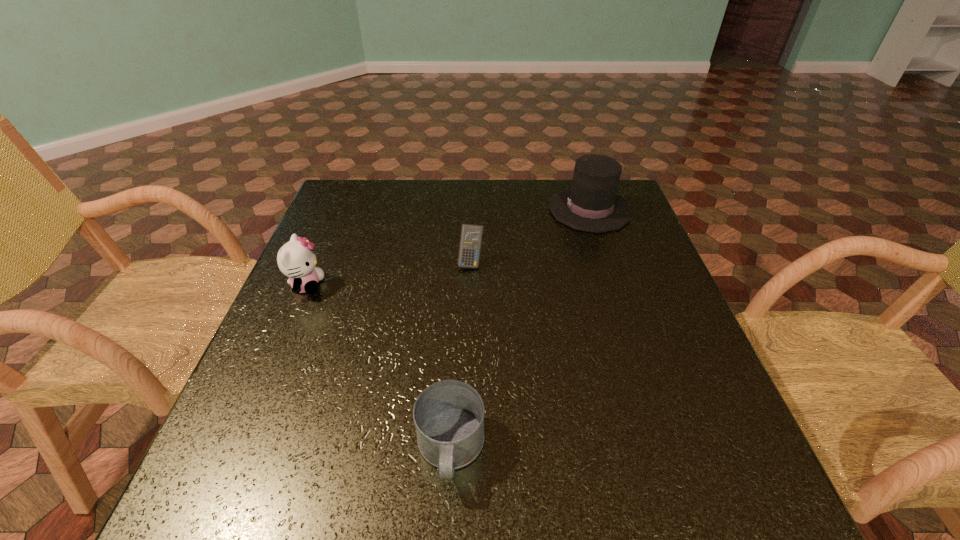
Find the location of `vacant space located 0.110m on the front-facing side of the third tallest object`. vacant space located 0.110m on the front-facing side of the third tallest object is located at coordinates pos(469,303).

At what (x,y) coordinates should I click in order to perform the action: click on object that is at the far edge. Please return your answer as a coordinate pair (x, y). Image resolution: width=960 pixels, height=540 pixels. Looking at the image, I should click on point(591,204).

Identify the location of object that is at the near edge. (448, 415).

Where is `object that is at the left edge`? The image size is (960, 540). object that is at the left edge is located at coordinates (296, 259).

This screenshot has height=540, width=960. What are the coordinates of `object that is at the right edge` in the screenshot? It's located at (591, 204).

Locate an element on the screen. The image size is (960, 540). object that is positioned at the far right corner is located at coordinates (591, 204).

At what (x,y) coordinates should I click in order to perform the action: click on vacant space at the far edge of the desktop. Please return your answer as a coordinate pair (x, y). Looking at the image, I should click on (498, 190).

At what (x,y) coordinates should I click in order to perform the action: click on vacant space at the near edge of the desktop. Please return your answer as a coordinate pair (x, y). The width and height of the screenshot is (960, 540). Looking at the image, I should click on (463, 522).

This screenshot has height=540, width=960. In the image, there is a desktop. Identify the location of vacant space at the left edge. (289, 464).

You are a GUI agent. You are given a task and a screenshot of the screen. Output one action in this format:
    pyautogui.click(x=<x>, y=<y>)
    Task: Click on the vacant space at the right edge of the desktop
    Image resolution: width=960 pixels, height=540 pixels.
    Given the screenshot: What is the action you would take?
    point(659,377)